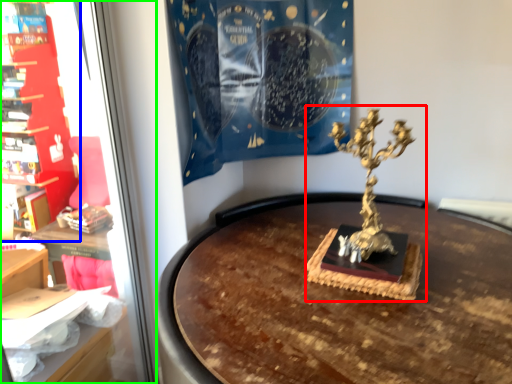
Question: Which object is the closest to the sculpture (highlighted by a red box)? Choose among these: furniture (highlighted by a blue box) or shop window (highlighted by a green box).

Choices:
 (A) furniture
 (B) shop window

Answer: (B)